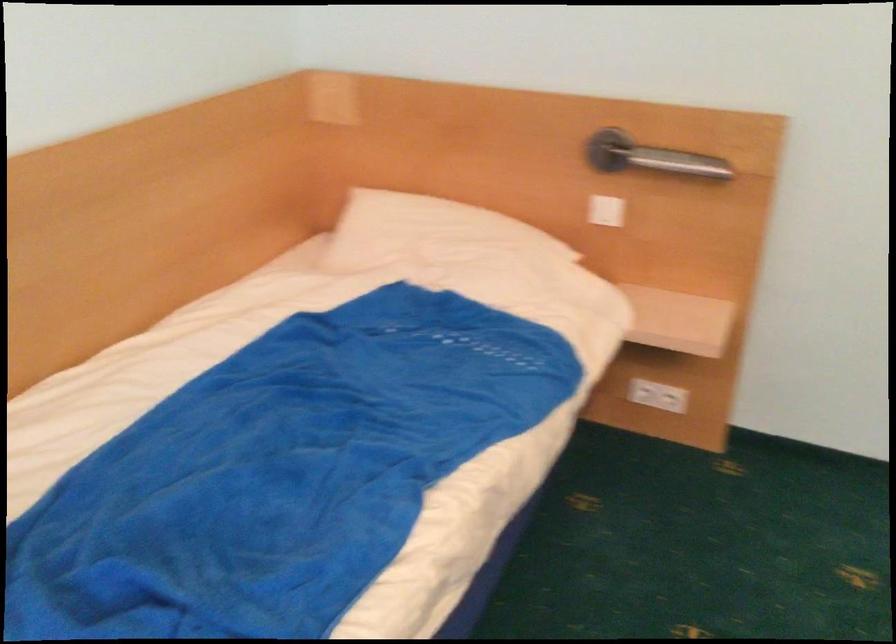
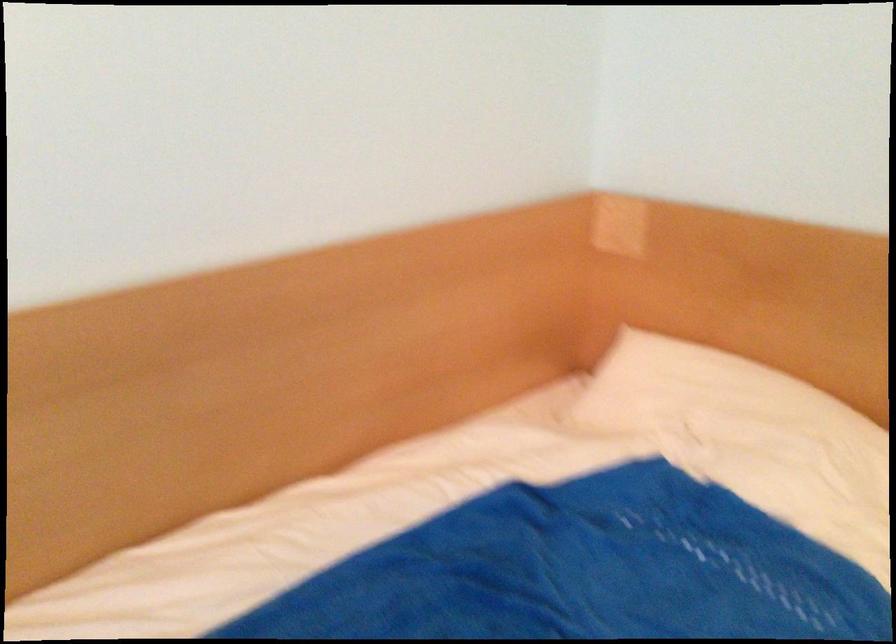
Question: Which direction would the cameraman need to move to produce the second image? Reply with the corresponding letter.

Choices:
 (A) Left
 (B) Right
 (C) Forward
 (D) Backward

Answer: (C)